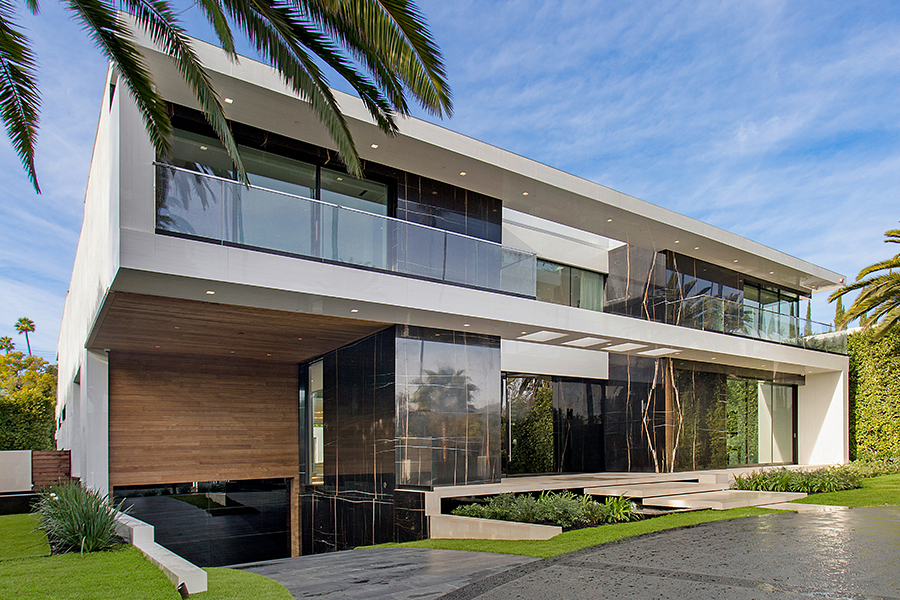
Where is `lights`? The image size is (900, 600). lights is located at coordinates (371, 141), (465, 169).